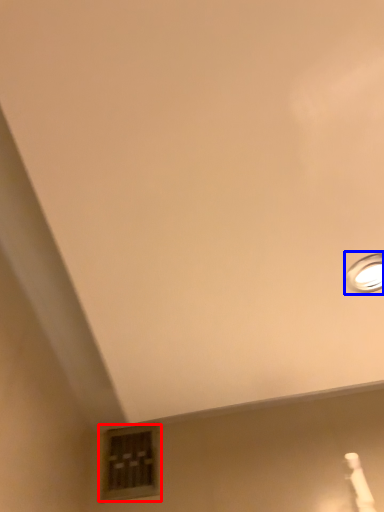
Question: Which of the following is the closest to the observer, window (highlighted by a red box) or lamp (highlighted by a blue box)?

Choices:
 (A) window
 (B) lamp

Answer: (B)